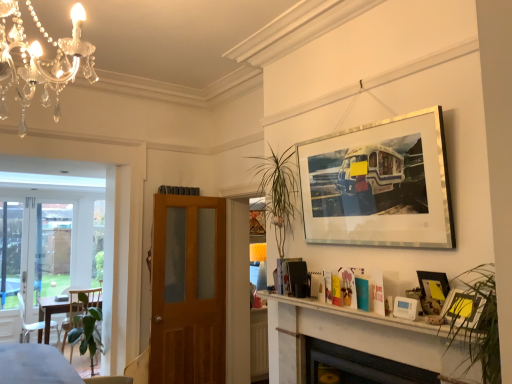
At what (x,y) coordinates should I click in order to perform the action: click on wooden door at center. Please return your answer as a coordinate pair (x, y). Image resolution: width=512 pixels, height=384 pixels. Looking at the image, I should click on (188, 290).

The image size is (512, 384). Describe the element at coordinates (433, 291) in the screenshot. I see `metallic silver picture frame at upper right, positioned as the 3th picture frame in top-to-bottom order` at that location.

You are a GUI agent. You are given a task and a screenshot of the screen. Output one action in this format:
    pyautogui.click(x=<x>, y=<y>)
    Task: Click on the black glass fireplace at lower center
    
    Given the screenshot: What is the action you would take?
    pyautogui.click(x=361, y=366)

Does point (186, 225) come behind point (19, 296)?

No, it is not.

Is wooden door at center touching white plastic chair at lower left?

wooden door at center and white plastic chair at lower left are not in contact.

From the picture: From a real-world perspective, who is located higher, wooden door at center or white plastic chair at lower left?

wooden door at center, from a real-world perspective.

From the image's perspective, is wooden door at center positioned above or below white plastic chair at lower left?

From the image's perspective, wooden door at center appears above white plastic chair at lower left.

Is metallic silver picture frame at upper right, acting as the second picture frame starting from the bottom, at the left side of white plastic chair at lower left?

No.

From the image's perspective, is metallic silver picture frame at upper right, acting as the second picture frame starting from the bottom, over white plastic chair at lower left?

Yes, from the image's perspective, metallic silver picture frame at upper right, acting as the second picture frame starting from the bottom, is on top of white plastic chair at lower left.

Which is in front, point (436, 300) or point (38, 326)?

The point (436, 300) is closer.

Is metallic silver picture frame at upper right, acting as the second picture frame starting from the bottom, not within white plastic chair at lower left?

Yes.

The height and width of the screenshot is (384, 512). Find the location of `chair below the white marble fireplace at lower center (from the image's perspective)`. chair below the white marble fireplace at lower center (from the image's perspective) is located at coordinates (28, 324).

From a real-world perspective, is white plastic chair at lower left physically above white marble fireplace at lower center?

No, from a real-world perspective, white plastic chair at lower left is not on top of white marble fireplace at lower center.

Which object is positioned more to the left, white plastic chair at lower left or white marble fireplace at lower center?

From the viewer's perspective, white plastic chair at lower left appears more on the left side.

Is the position of white plastic chair at lower left less distant than that of white marble fireplace at lower center?

No, white plastic chair at lower left is behind white marble fireplace at lower center.

Do you think white plastic thermostat at lower right, acting as the 4th picture frame starting from the top, is within green glossy plant at lower left, or outside of it?

white plastic thermostat at lower right, acting as the 4th picture frame starting from the top, lies outside green glossy plant at lower left.

Is point (398, 316) behind point (102, 347)?

No, (398, 316) is in front of (102, 347).

In the scene shown: In terms of width, does white plastic thermostat at lower right, which is the 1th picture frame from bottom to top, look wider or thinner when compared to green glossy plant at lower left?

Clearly, white plastic thermostat at lower right, which is the 1th picture frame from bottom to top, has less width compared to green glossy plant at lower left.

Is white plastic thermostat at lower right, acting as the 4th picture frame starting from the top, not near white plastic chair at lower left?

Yes, white plastic thermostat at lower right, acting as the 4th picture frame starting from the top, and white plastic chair at lower left are located far from each other.

How many degrees apart are the facing directions of white plastic thermostat at lower right, which is the 1th picture frame from bottom to top, and white plastic chair at lower left?

The angular difference between white plastic thermostat at lower right, which is the 1th picture frame from bottom to top, and white plastic chair at lower left is 174 degrees.

From the image's perspective, between white plastic thermostat at lower right, acting as the 4th picture frame starting from the top, and white plastic chair at lower left, who is located below?

white plastic chair at lower left is shown below in the image.

Considering the positions of objects black glass fireplace at lower center and green glossy plant at lower left in the image provided, who is behind, black glass fireplace at lower center or green glossy plant at lower left?

green glossy plant at lower left is further from the camera.

From a real-world perspective, who is located higher, black glass fireplace at lower center or green glossy plant at lower left?

black glass fireplace at lower center.

Which of these two, black glass fireplace at lower center or green glossy plant at lower left, stands shorter?

With less height is black glass fireplace at lower center.

From the image's perspective, is black glass fireplace at lower center below green glossy plant at lower left?

Actually, black glass fireplace at lower center appears above green glossy plant at lower left in the image.

Is black glass fireplace at lower center surrounded by green glossy plant at lower left?

No, green glossy plant at lower left does not contain black glass fireplace at lower center.

Looking at this image, considering the relative sizes of green glossy plant at lower left and black glass fireplace at lower center in the image provided, is green glossy plant at lower left shorter than black glass fireplace at lower center?

In fact, green glossy plant at lower left may be taller than black glass fireplace at lower center.

From a real-world perspective, who is located higher, green glossy plant at lower left or black glass fireplace at lower center?

black glass fireplace at lower center is physically above.

Image resolution: width=512 pixels, height=384 pixels. Identify the location of chair lying behind the wooden door at center. (28, 324).

Where is `chair that is below the metallic silver picture frame at upper right, positioned as the 3th picture frame in top-to-bottom order (from the image's perspective)`? This screenshot has width=512, height=384. chair that is below the metallic silver picture frame at upper right, positioned as the 3th picture frame in top-to-bottom order (from the image's perspective) is located at coordinates (28, 324).

From the image, which object appears to be nearer to black glass fireplace at lower center, wooden door at center or silver/metallic picture frame at upper right, the 1th picture frame viewed from the top?

The object closer to black glass fireplace at lower center is silver/metallic picture frame at upper right, the 1th picture frame viewed from the top.

Based on their spatial positions, is green glossy plant at lower left or white marble fireplace at lower center closer to silver/metallic picture frame at upper right, the 1th picture frame viewed from the top?

white marble fireplace at lower center.

Based on their spatial positions, is matte yellow picture frame at lower right, which appears as the 2th picture frame when viewed from the top, or black glass fireplace at lower center further from silver/metallic picture frame at upper right, which ranks as the fourth picture frame in bottom-to-top order?

black glass fireplace at lower center is further to silver/metallic picture frame at upper right, which ranks as the fourth picture frame in bottom-to-top order.

Looking at the image, which one is located closer to white marble fireplace at lower center, wooden door at center or black glass fireplace at lower center?

black glass fireplace at lower center.

From the image, which object appears to be farther from white plastic chair at lower left, white plastic thermostat at lower right, which is the 1th picture frame from bottom to top, or green glossy plant at lower left?

white plastic thermostat at lower right, which is the 1th picture frame from bottom to top.

Looking at the image, which one is located further to white marble fireplace at lower center, white plastic thermostat at lower right, which is the 1th picture frame from bottom to top, or matte yellow picture frame at lower right, which appears as the 2th picture frame when viewed from the top?

Among the two, white plastic thermostat at lower right, which is the 1th picture frame from bottom to top, is located further to white marble fireplace at lower center.

When comparing their distances from green glossy plant at lower left, does wooden door at center or white plastic chair at lower left seem closer?

Among the two, wooden door at center is located nearer to green glossy plant at lower left.

Estimate the real-world distances between objects in this image. Which object is further from wooden door at center, green glossy plant at lower left or white plastic thermostat at lower right, acting as the 4th picture frame starting from the top?

white plastic thermostat at lower right, acting as the 4th picture frame starting from the top, lies further to wooden door at center than the other object.

Locate an element on the screen. The width and height of the screenshot is (512, 384). mantle between silver/metallic picture frame at upper right, the 1th picture frame viewed from the top, and black glass fireplace at lower center, in the vertical direction is located at coordinates (367, 315).

I want to click on fireplace between green glossy plant at lower left and metallic silver picture frame at upper right, acting as the second picture frame starting from the bottom, so (361, 366).

Where is `picture frame between white plastic chair at lower left and white plastic thermostat at lower right, which is the 1th picture frame from bottom to top, in the horizontal direction`? Image resolution: width=512 pixels, height=384 pixels. picture frame between white plastic chair at lower left and white plastic thermostat at lower right, which is the 1th picture frame from bottom to top, in the horizontal direction is located at coordinates (379, 184).

The width and height of the screenshot is (512, 384). In order to click on mantle located between green glossy plant at lower left and black glass fireplace at lower center in the left-right direction in this screenshot , I will do `click(367, 315)`.